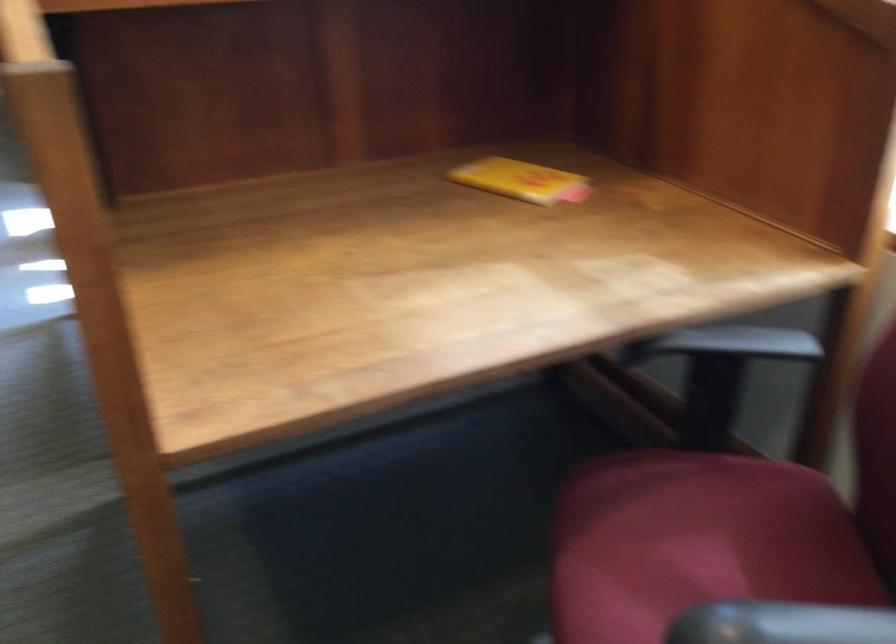
Identify the location of black chair armrest. The width and height of the screenshot is (896, 644). (780, 623).